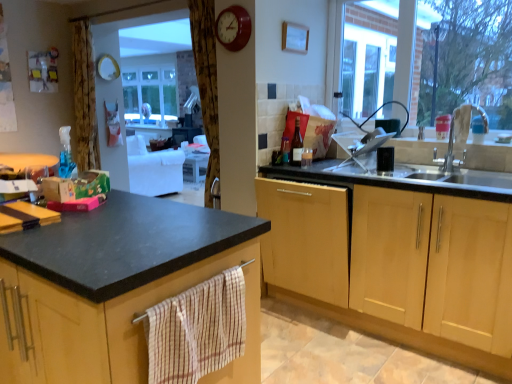
Question: Considering the relative positions of metallic sink at right and matte black countertop at left, the 2th cabinetry viewed from the right, in the image provided, is metallic sink at right behind matte black countertop at left, the 2th cabinetry viewed from the right,?

Choices:
 (A) yes
 (B) no

Answer: (A)

Question: Is metallic sink at right to the left of matte black countertop at left, the 1th cabinetry in the left-to-right sequence, from the viewer's perspective?

Choices:
 (A) yes
 (B) no

Answer: (B)

Question: From a real-world perspective, is metallic sink at right located higher than matte black countertop at left, the 1th cabinetry in the left-to-right sequence?

Choices:
 (A) yes
 (B) no

Answer: (A)

Question: From the image's perspective, is metallic sink at right on matte black countertop at left, the 1th cabinetry in the left-to-right sequence?

Choices:
 (A) no
 (B) yes

Answer: (B)

Question: Can you confirm if metallic sink at right is shorter than matte black countertop at left, the 1th cabinetry in the left-to-right sequence?

Choices:
 (A) no
 (B) yes

Answer: (B)

Question: Is light wood cabinet at center, the 2th cabinetry in the left-to-right sequence, to the left or to the right of matte black countertop at left, the 2th cabinetry viewed from the right, in the image?

Choices:
 (A) left
 (B) right

Answer: (B)

Question: Is light wood cabinet at center, the 2th cabinetry in the left-to-right sequence, situated inside matte black countertop at left, the 2th cabinetry viewed from the right, or outside?

Choices:
 (A) inside
 (B) outside

Answer: (B)

Question: Relative to matte black countertop at left, the 2th cabinetry viewed from the right, is light wood cabinet at center, the first cabinetry from the right, in front or behind?

Choices:
 (A) front
 (B) behind

Answer: (B)

Question: Considering the positions of point (330, 233) and point (173, 278), is point (330, 233) closer or farther from the camera than point (173, 278)?

Choices:
 (A) farther
 (B) closer

Answer: (A)

Question: From a real-world perspective, is matte black countertop at left, the 2th cabinetry viewed from the right, above or below matte red clock at upper center?

Choices:
 (A) above
 (B) below

Answer: (B)

Question: Is matte black countertop at left, the 1th cabinetry in the left-to-right sequence, taller or shorter than matte red clock at upper center?

Choices:
 (A) short
 (B) tall

Answer: (B)

Question: Looking at the image, does matte black countertop at left, the 1th cabinetry in the left-to-right sequence, seem bigger or smaller compared to matte red clock at upper center?

Choices:
 (A) big
 (B) small

Answer: (A)

Question: Is matte black countertop at left, the 2th cabinetry viewed from the right, wider or thinner than matte red clock at upper center?

Choices:
 (A) thin
 (B) wide

Answer: (B)

Question: Considering the positions of white matte tap at right and metallic sink at right in the image, is white matte tap at right bigger or smaller than metallic sink at right?

Choices:
 (A) small
 (B) big

Answer: (A)

Question: From the image's perspective, is white matte tap at right located above or below metallic sink at right?

Choices:
 (A) below
 (B) above

Answer: (B)